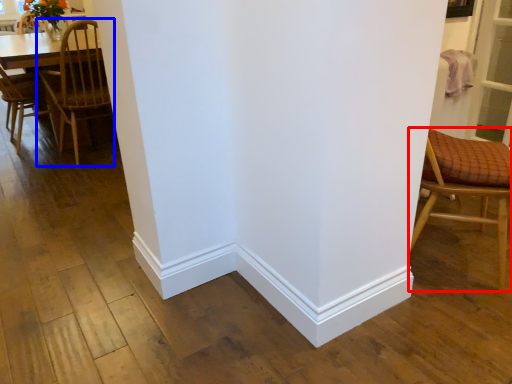
Question: Which point is closer to the camera, chair (highlighted by a red box) or chair (highlighted by a blue box)?

Choices:
 (A) chair
 (B) chair

Answer: (A)